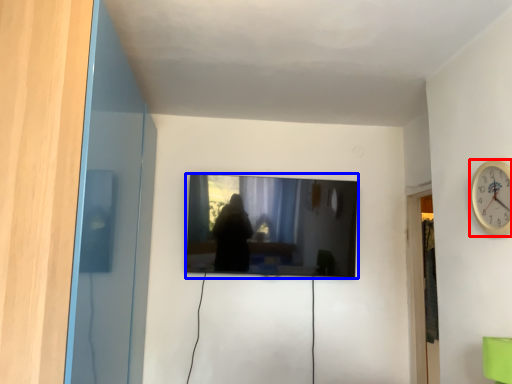
Question: Which point is further to the camera, wall clock (highlighted by a red box) or television (highlighted by a blue box)?

Choices:
 (A) wall clock
 (B) television

Answer: (B)